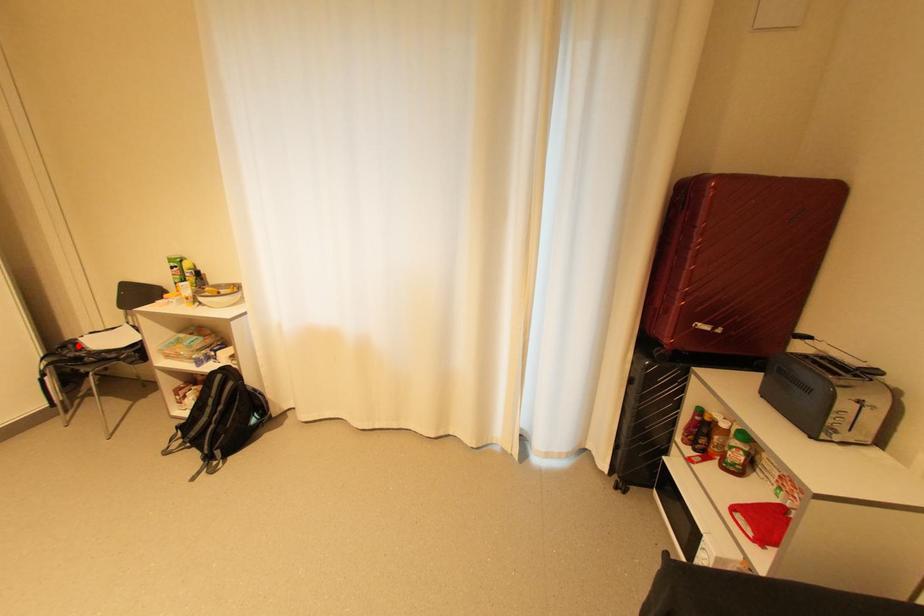
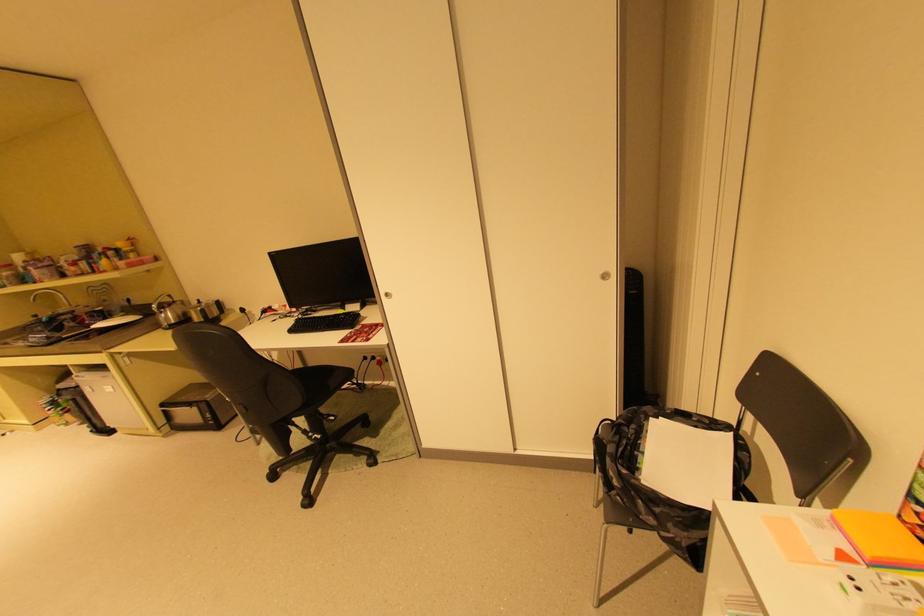
Find the pixel in the second image that matches the highlighted location in the first image.

(640, 427)